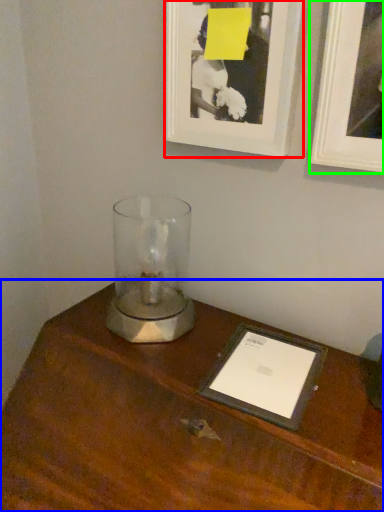
Question: Considering the real-world distances, which object is farthest from picture frame (highlighted by a red box)? table (highlighted by a blue box) or picture frame (highlighted by a green box)?

Choices:
 (A) table
 (B) picture frame

Answer: (A)